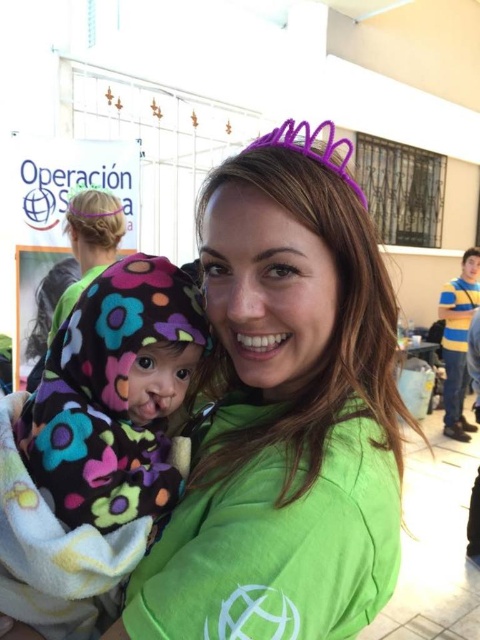
Can you confirm if green matte shirt at center is thinner than fluffy fleece blanket at center?

Incorrect, green matte shirt at center's width is not less than fluffy fleece blanket at center's.

Is green matte shirt at center closer to camera compared to fluffy fleece blanket at center?

Yes, green matte shirt at center is in front of fluffy fleece blanket at center.

Which is behind, point (300, 337) or point (58, 360)?

The point (58, 360) is behind.

Find the location of a particular element. Image resolution: width=480 pixels, height=640 pixels. green matte shirt at center is located at coordinates (286, 413).